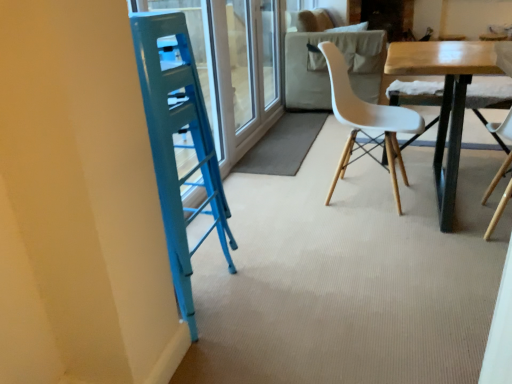
Question: From a real-world perspective, is transparent glass screen door at upper center on wooden table at center?

Choices:
 (A) no
 (B) yes

Answer: (B)

Question: Considering the relative positions of transparent glass screen door at upper center and wooden table at center in the image provided, is transparent glass screen door at upper center to the right of wooden table at center from the viewer's perspective?

Choices:
 (A) yes
 (B) no

Answer: (B)

Question: Considering the relative sizes of transparent glass screen door at upper center and wooden table at center in the image provided, is transparent glass screen door at upper center shorter than wooden table at center?

Choices:
 (A) no
 (B) yes

Answer: (A)

Question: Could you tell me if transparent glass screen door at upper center is facing wooden table at center?

Choices:
 (A) yes
 (B) no

Answer: (A)

Question: Does transparent glass screen door at upper center have a smaller size compared to wooden table at center?

Choices:
 (A) no
 (B) yes

Answer: (B)

Question: Considering the positions of point (479, 49) and point (394, 119), is point (479, 49) closer or farther from the camera than point (394, 119)?

Choices:
 (A) farther
 (B) closer

Answer: (B)

Question: From their relative heights in the image, would you say wooden table at center is taller or shorter than white matte plastic chair at center?

Choices:
 (A) short
 (B) tall

Answer: (A)

Question: Relative to white matte plastic chair at center, is wooden table at center in front or behind?

Choices:
 (A) front
 (B) behind

Answer: (A)

Question: In terms of width, does wooden table at center look wider or thinner when compared to white matte plastic chair at center?

Choices:
 (A) wide
 (B) thin

Answer: (A)

Question: Based on their sizes in the image, would you say transparent glass screen door at upper center is bigger or smaller than white matte plastic chair at center?

Choices:
 (A) big
 (B) small

Answer: (B)

Question: Is point (225, 8) closer or farther from the camera than point (331, 193)?

Choices:
 (A) closer
 (B) farther

Answer: (B)

Question: Considering the relative positions of transparent glass screen door at upper center and white matte plastic chair at center in the image provided, is transparent glass screen door at upper center to the left or to the right of white matte plastic chair at center?

Choices:
 (A) left
 (B) right

Answer: (A)

Question: In the image, is transparent glass screen door at upper center positioned in front of or behind white matte plastic chair at center?

Choices:
 (A) front
 (B) behind

Answer: (B)

Question: From a real-world perspective, is transparent glass screen door at upper center positioned above or below wooden table at center?

Choices:
 (A) below
 (B) above

Answer: (B)

Question: In terms of size, does transparent glass screen door at upper center appear bigger or smaller than wooden table at center?

Choices:
 (A) small
 (B) big

Answer: (A)